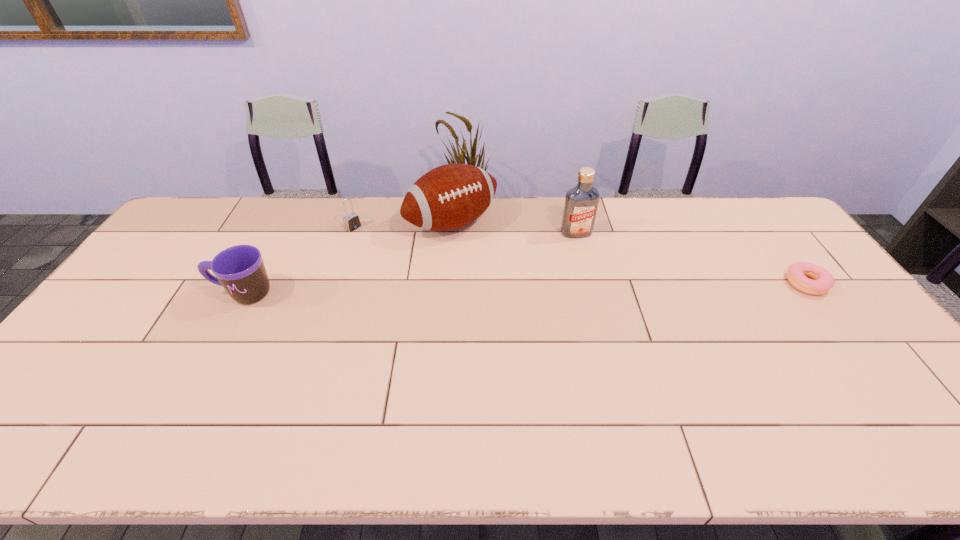
This screenshot has height=540, width=960. Identify the location of mug. (240, 269).

Find the location of a particular element. The width and height of the screenshot is (960, 540). the rightmost object is located at coordinates (823, 281).

At what (x,y) coordinates should I click in order to perform the action: click on doughnut. Please return your answer as a coordinate pair (x, y). This screenshot has height=540, width=960. Looking at the image, I should click on (823, 281).

The image size is (960, 540). Find the location of `football`. football is located at coordinates (449, 197).

The image size is (960, 540). I want to click on vodka, so click(x=581, y=203).

Where is `the second object from left to right`? Image resolution: width=960 pixels, height=540 pixels. the second object from left to right is located at coordinates [351, 221].

Locate an element on the screen. This screenshot has height=540, width=960. vacant region located 0.240m with the handle on the side of the mug is located at coordinates (132, 293).

Where is `free spot located with the handle on the side of the mug`? This screenshot has height=540, width=960. free spot located with the handle on the side of the mug is located at coordinates (125, 293).

I want to click on vacant position located 0.050m with the handle on the side of the mug, so click(196, 293).

You are a GUI agent. You are given a task and a screenshot of the screen. Output one action in this format:
    pyautogui.click(x=<x>, y=<y>)
    Task: Click on the free space located 0.060m on the front of the doughnut
    Image resolution: width=960 pixels, height=540 pixels.
    Given the screenshot: What is the action you would take?
    click(x=829, y=314)